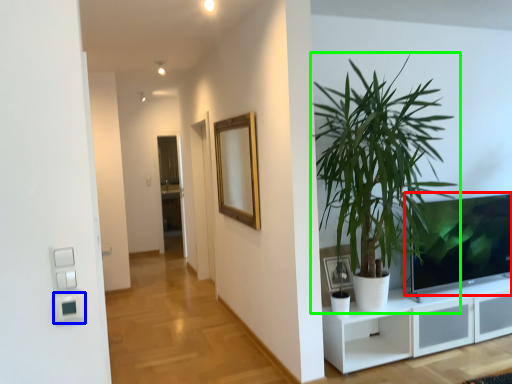
Question: Which object is positioned farthest from television (highlighted by a red box)? Select from light switch (highlighted by a blue box) and houseplant (highlighted by a green box).

Choices:
 (A) light switch
 (B) houseplant

Answer: (A)